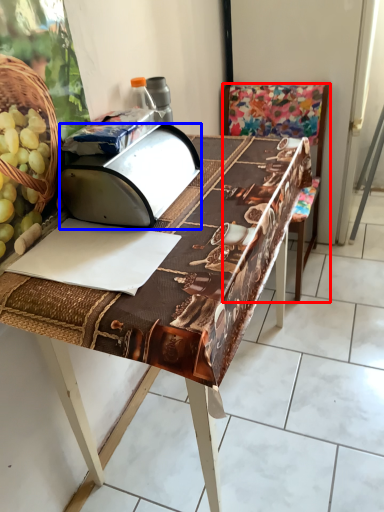
Question: Which of the following is the farthest to the observer, chair (highlighted by a red box) or wide (highlighted by a blue box)?

Choices:
 (A) chair
 (B) wide

Answer: (A)